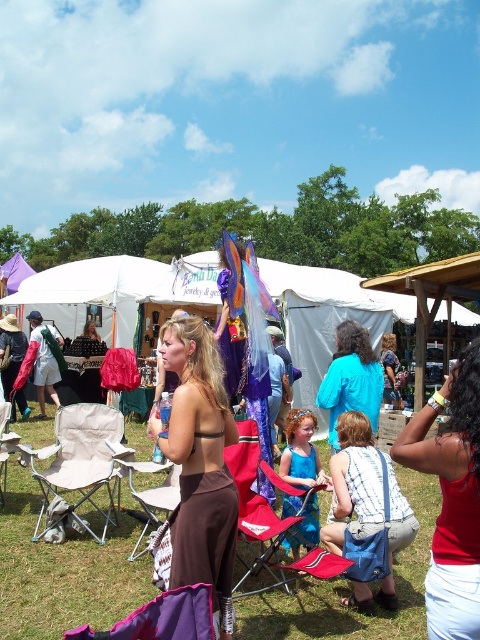
You are organizing a picnic and need to place a beige fabric chair at lower left and a blue cotton shirt at center. According to the scene, where should you place the blue cotton shirt relative to the beige fabric chair?

The beige fabric chair at lower left is positioned on the left side of blue cotton shirt at center, so the blue cotton shirt at center should be placed to the right of the beige fabric chair at lower left.

You are organizing a small gathering and need to seat two guests. You have a beige fabric chair at lower left and a blue cotton shirt at center. Which object can be used as seating?

The beige fabric chair at lower left can be used as seating because it is a chair, while the blue cotton shirt at center is clothing and not designed for sitting.